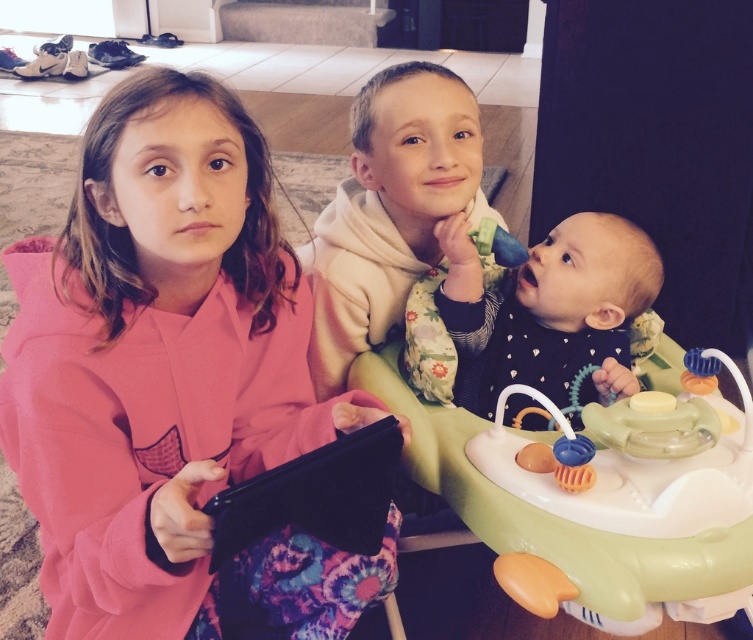
Question: Which point is farther from the camera taking this photo?

Choices:
 (A) (517, 353)
 (B) (404, 433)

Answer: (A)

Question: Which object is positioned closest to the soft green highchair at center?

Choices:
 (A) pink matte hoodie at center
 (B) white soft hoodie at center

Answer: (B)

Question: Which of the following is the farthest from the observer?

Choices:
 (A) white soft hoodie at center
 (B) pink matte hoodie at center
 (C) soft green highchair at center

Answer: (A)

Question: Does white soft hoodie at center have a larger size compared to soft green highchair at center?

Choices:
 (A) yes
 (B) no

Answer: (A)

Question: Is the position of pink matte hoodie at center more distant than that of white soft hoodie at center?

Choices:
 (A) yes
 (B) no

Answer: (B)

Question: Does pink matte hoodie at center appear on the right side of soft green highchair at center?

Choices:
 (A) no
 (B) yes

Answer: (A)